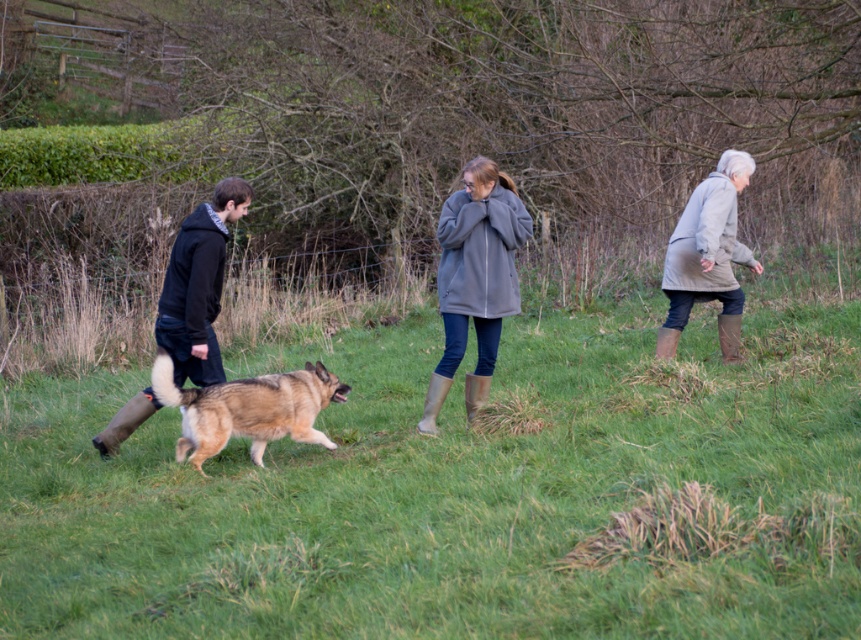
You are standing in the middle of the grassy field and see the dark brown leather boots at left and the light gray coat at right. Which object is closer to you?

The dark brown leather boots at left are closer to you since they are positioned in front of the light gray coat at right.